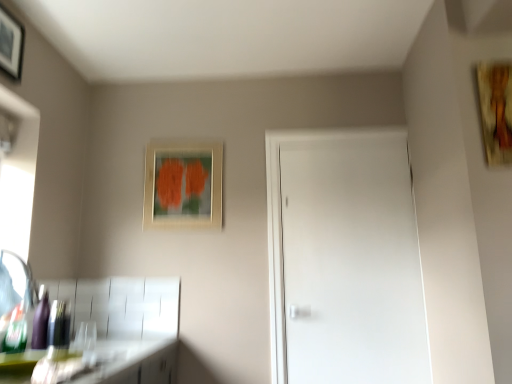
This screenshot has height=384, width=512. In order to click on free space above white matte door at center (from a real-world perspective) in this screenshot , I will do pos(343,143).